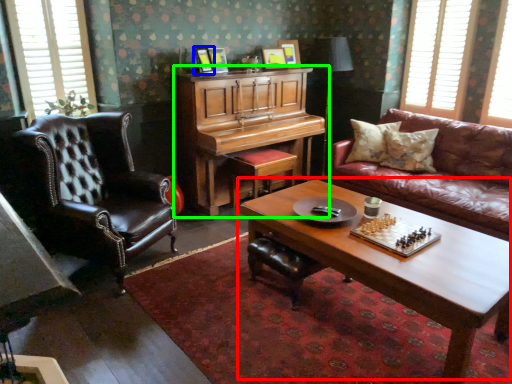
Question: Based on their relative distances, which object is nearer to coffee table (highlighted by a red box)? Choose from picture frame (highlighted by a blue box) and piano (highlighted by a green box).

Choices:
 (A) picture frame
 (B) piano

Answer: (B)